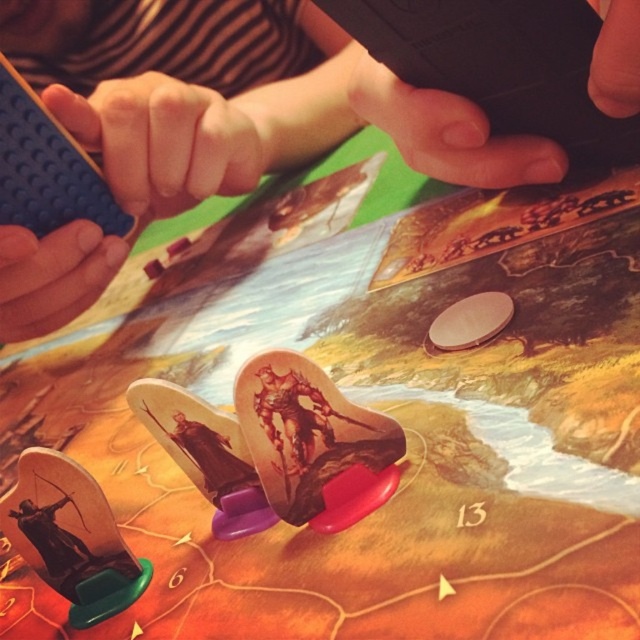
You are trying to stack the blue plastic lego brick at upper left and the black matte phone at upper center on top of each other. Which one should you place at the bottom to ensure stability?

The blue plastic lego brick at upper left should be placed at the bottom since it has a greater height than the black matte phone at upper center, providing a more stable base.

You are setting up a display for a board game store. You have to place the blue plastic lego brick at upper left and the black matte phone at upper center on the board game. Given their sizes, which object should be placed first to ensure stability?

The blue plastic lego brick at upper left should be placed first because it has a larger size compared to the black matte phone at upper center, providing a stable base for the smaller object.

You are playing a board game and need to place a new token on the board. The blue plastic lego brick at upper left and the black matte phone at upper center are already on the board. Which object is positioned higher on the board?

The blue plastic lego brick at upper left is positioned higher on the board than the black matte phone at upper center, as it is located above it.